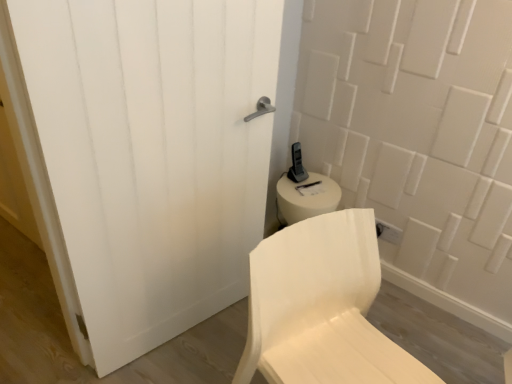
Question: Should I look upward or downward to see white matte chair at center?

Choices:
 (A) down
 (B) up

Answer: (A)

Question: Is white matte chair at center inside white matte door at center?

Choices:
 (A) no
 (B) yes

Answer: (A)

Question: From a real-world perspective, is white matte door at center below white matte chair at center?

Choices:
 (A) no
 (B) yes

Answer: (A)

Question: Is white matte door at center not close to white matte chair at center?

Choices:
 (A) no
 (B) yes

Answer: (A)

Question: Could you tell me if white matte door at center is turned towards white matte chair at center?

Choices:
 (A) yes
 (B) no

Answer: (A)

Question: Is white matte door at center placed right next to white matte chair at center?

Choices:
 (A) no
 (B) yes

Answer: (A)

Question: Is white matte door at center wider than white matte chair at center?

Choices:
 (A) yes
 (B) no

Answer: (B)

Question: Is white matte chair at center behind white matte door at center?

Choices:
 (A) yes
 (B) no

Answer: (B)

Question: Is white matte chair at center to the right of white matte door at center from the viewer's perspective?

Choices:
 (A) yes
 (B) no

Answer: (A)

Question: Is white matte chair at center closer to the viewer compared to white matte door at center?

Choices:
 (A) no
 (B) yes

Answer: (B)

Question: Can you confirm if white matte chair at center is bigger than white matte door at center?

Choices:
 (A) no
 (B) yes

Answer: (B)

Question: Could you tell me if white matte chair at center is facing white matte door at center?

Choices:
 (A) yes
 (B) no

Answer: (B)

Question: From the image's perspective, is white matte chair at center below white matte door at center?

Choices:
 (A) yes
 (B) no

Answer: (A)

Question: In terms of size, does white matte door at center appear bigger or smaller than white matte chair at center?

Choices:
 (A) small
 (B) big

Answer: (A)